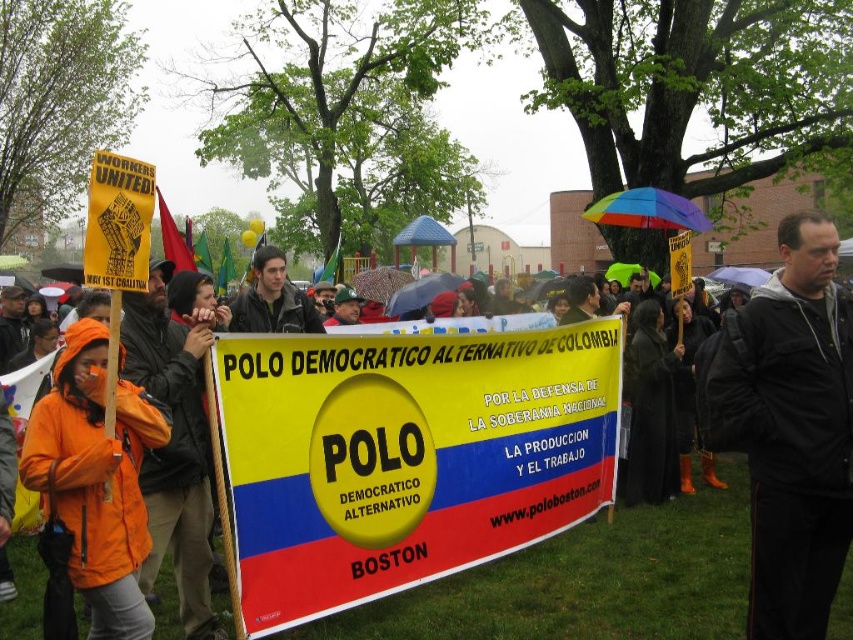
Does yellow fabric banner at center have a lesser height compared to orange waterproof jacket at left?

No.

Does point (288, 396) come farther from viewer compared to point (108, 598)?

That is True.

Identify the location of yellow fabric banner at center. Image resolution: width=853 pixels, height=640 pixels. pyautogui.click(x=408, y=452).

Locate an element on the screen. Image resolution: width=853 pixels, height=640 pixels. yellow fabric banner at center is located at coordinates (408, 452).

Can you confirm if black jacket at center is positioned above orange waterproof jacket at left?

Correct, black jacket at center is located above orange waterproof jacket at left.

Can you confirm if black jacket at center is positioned to the left of orange waterproof jacket at left?

No, black jacket at center is not to the left of orange waterproof jacket at left.

Does point (779, 332) come behind point (68, 358)?

Yes, it is.

Locate an element on the screen. black jacket at center is located at coordinates click(790, 428).

Does point (231, 413) come closer to viewer compared to point (788, 307)?

No, (231, 413) is behind (788, 307).

Who is positioned more to the left, yellow fabric banner at center or black jacket at center?

Positioned to the left is yellow fabric banner at center.

Between point (425, 568) and point (814, 481), which one is positioned in front?

Point (814, 481)

Find the location of a particular element. yellow fabric banner at center is located at coordinates (408, 452).